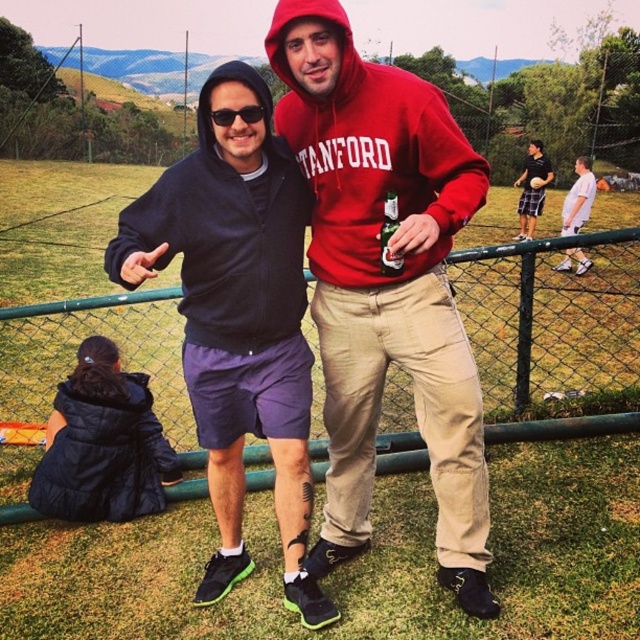
Can you confirm if green chain-link fence at center is positioned below black plastic sunglasses at upper center?

Yes, green chain-link fence at center is below black plastic sunglasses at upper center.

Who is more forward, (x=45, y=348) or (x=241, y=113)?

Positioned in front is point (x=241, y=113).

In order to click on green chain-link fence at center in this screenshot , I will do `click(552, 324)`.

Between green chain-link fence at center and white matte shirt at right, which one has more height?

With more height is white matte shirt at right.

Where is `green chain-link fence at center`? The width and height of the screenshot is (640, 640). green chain-link fence at center is located at coordinates (552, 324).

Based on the photo, is matte black hoodie at center taller than black plastic sunglasses at upper center?

Yes.

Looking at this image, can you confirm if matte black hoodie at center is positioned below black plastic sunglasses at upper center?

Correct, matte black hoodie at center is located below black plastic sunglasses at upper center.

Who is more forward, (230, 570) or (260, 116)?

Point (260, 116)

You are a GUI agent. You are given a task and a screenshot of the screen. Output one action in this format:
    pyautogui.click(x=<x>, y=<y>)
    Task: Click on the matte black hoodie at center
    
    Given the screenshot: What is the action you would take?
    pyautogui.click(x=237, y=317)